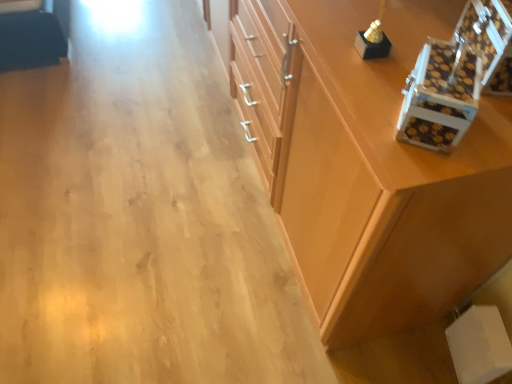
Locate an element on the screen. Image resolution: width=512 pixels, height=384 pixels. vacant space that is to the left of white textured box at upper right, the second box in the right-to-left sequence is located at coordinates (365, 104).